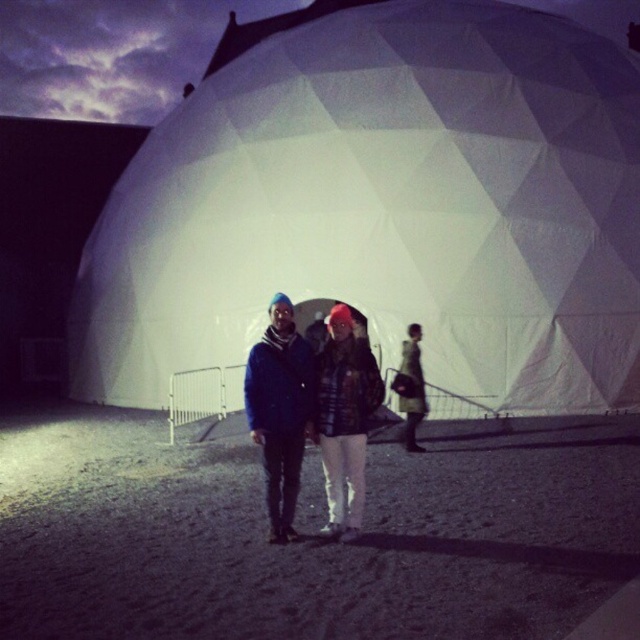
Question: Which is farther from the dark blue jacket at center?

Choices:
 (A) plaid fabric coat at center
 (B) white fabric dome at center

Answer: (B)

Question: Which of the following is the closest to the observer?

Choices:
 (A) (330, 369)
 (B) (268, 408)

Answer: (B)

Question: Which of the following is the closest to the observer?

Choices:
 (A) (262, 61)
 (B) (339, 385)

Answer: (B)

Question: Can you confirm if white fabric dome at center is smaller than dark blue jacket at center?

Choices:
 (A) no
 (B) yes

Answer: (A)

Question: Is the position of white fabric dome at center less distant than that of plaid fabric coat at center?

Choices:
 (A) no
 (B) yes

Answer: (A)

Question: Is white fabric dome at center bigger than dark blue jacket at center?

Choices:
 (A) yes
 (B) no

Answer: (A)